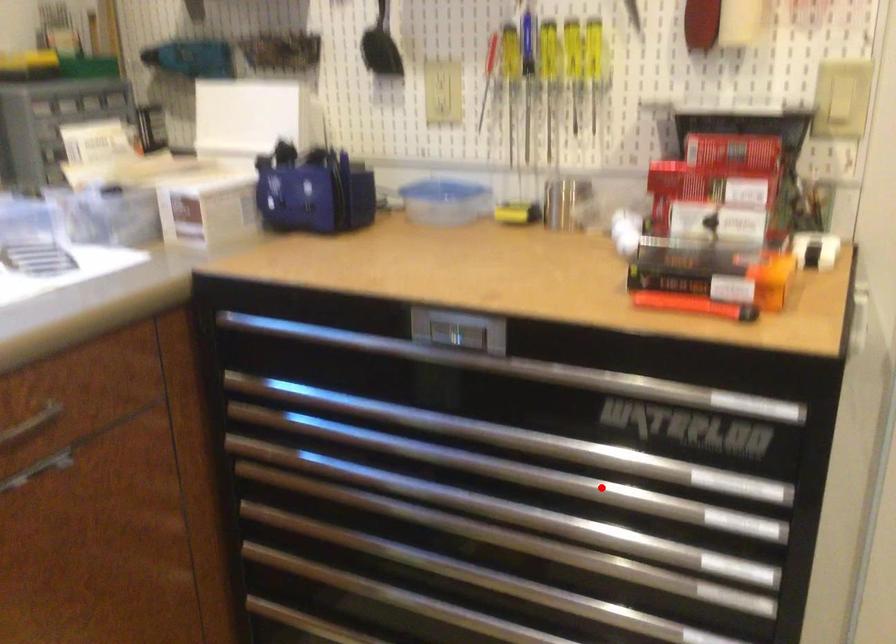
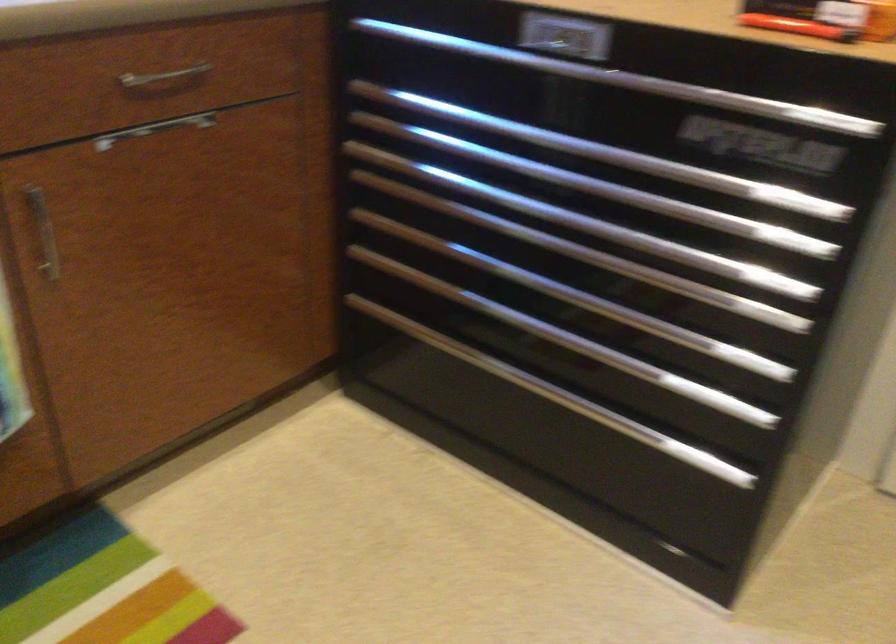
In the second image, find the point that corresponds to the highlighted location in the first image.

(666, 205)